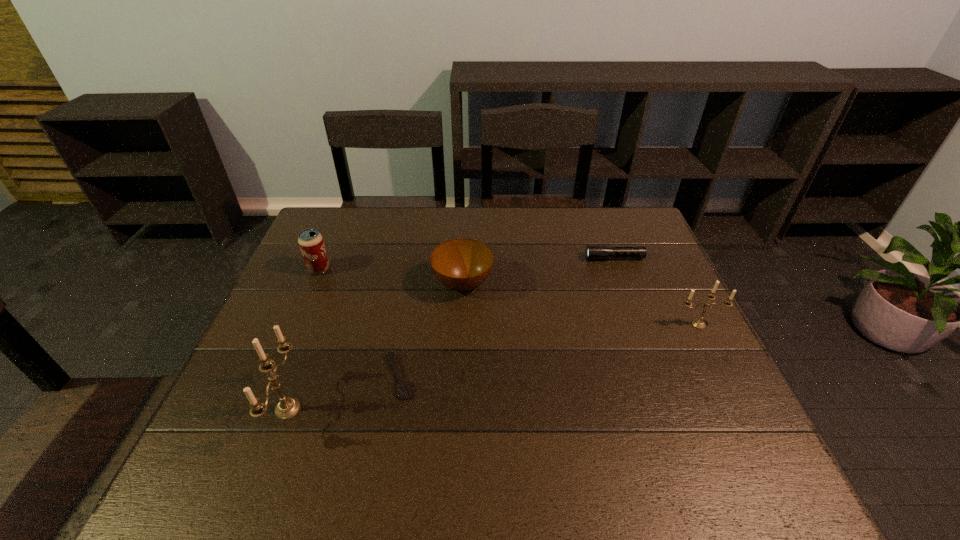
At what (x,y) coordinates should I click in order to perform the action: click on candle that is at the near edge. Please return your answer as a coordinate pair (x, y). Looking at the image, I should click on (287, 408).

This screenshot has width=960, height=540. In order to click on soupspoon at the near edge in this screenshot , I will do `click(403, 388)`.

Find the location of a particular element. This screenshot has height=540, width=960. candle positioned at the left edge is located at coordinates (287, 408).

Where is `beer can that is at the left edge`? Image resolution: width=960 pixels, height=540 pixels. beer can that is at the left edge is located at coordinates (310, 241).

Identify the location of candle at the right edge. (697, 323).

The height and width of the screenshot is (540, 960). In order to click on flashlight that is positioned at the right edge in this screenshot , I will do pyautogui.click(x=593, y=252).

Locate an element on the screen. The image size is (960, 540). object that is at the near left corner is located at coordinates (287, 408).

The height and width of the screenshot is (540, 960). I want to click on free region at the far edge, so click(502, 209).

This screenshot has width=960, height=540. In the image, there is a desktop. What are the coordinates of `free space at the near edge` in the screenshot? It's located at (477, 402).

At what (x,y) coordinates should I click in order to perform the action: click on free space at the right edge of the desktop. Please return your answer as a coordinate pair (x, y). This screenshot has width=960, height=540. Looking at the image, I should click on (633, 267).